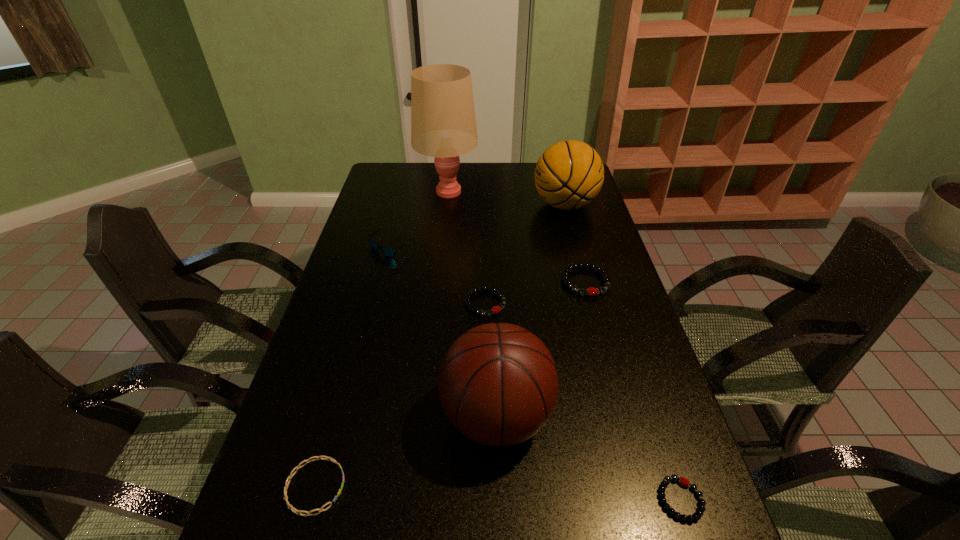
What are the coordinates of `the leftmost black bracelet` in the screenshot? It's located at (496, 309).

At what (x,y) coordinates should I click in order to perform the action: click on the third shortest bracelet. Please return your answer as a coordinate pair (x, y). Looking at the image, I should click on (496, 309).

Find the location of `blue bracelet`. blue bracelet is located at coordinates (291, 475).

The width and height of the screenshot is (960, 540). What are the coordinates of `the nearest black bracelet` in the screenshot? It's located at (698, 513).

This screenshot has width=960, height=540. In order to click on free space located 0.320m on the front of the pink lampshade in this screenshot , I will do `click(440, 260)`.

Where is `vacant region located on the surface of the right basketball near the brand logo`? The height and width of the screenshot is (540, 960). vacant region located on the surface of the right basketball near the brand logo is located at coordinates (504, 205).

At what (x,y) coordinates should I click in order to perform the action: click on vacant point located on the surface of the right basketball near the brand logo. Please return your answer as a coordinate pair (x, y). The width and height of the screenshot is (960, 540). Looking at the image, I should click on (470, 205).

You are a GUI agent. You are given a task and a screenshot of the screen. Output one action in this format:
    pyautogui.click(x=<x>, y=<y>)
    Task: Click on the free space located 0.360m on the surface of the right basketball near the brand logo
    This screenshot has width=960, height=540.
    Given the screenshot: What is the action you would take?
    pyautogui.click(x=440, y=205)

Locate an element on the screen. Image resolution: width=960 pixels, height=540 pixels. blank area located on the back of the nearer basketball is located at coordinates (494, 325).

Image resolution: width=960 pixels, height=540 pixels. Identify the location of vacant position located at the front of the sunglasses showing the lenses. (370, 332).